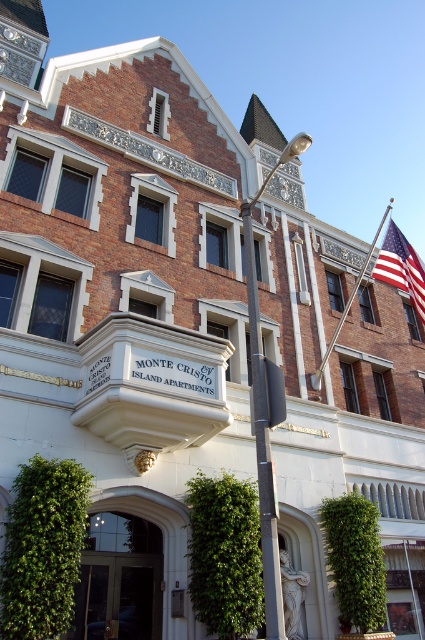
Does metallic pole at center have a lesser height compared to metallic flag pole at upper right?

Indeed, metallic pole at center has a lesser height compared to metallic flag pole at upper right.

Which of these two, metallic pole at center or metallic flag pole at upper right, stands shorter?

metallic pole at center is shorter.

Which is in front, point (246, 268) or point (371, 246)?

Point (246, 268)

Locate an element on the screen. The height and width of the screenshot is (640, 425). metallic pole at center is located at coordinates (265, 412).

The width and height of the screenshot is (425, 640). Describe the element at coordinates (265, 412) in the screenshot. I see `metallic pole at center` at that location.

Which is in front, point (272, 596) or point (382, 280)?

Point (272, 596) is more forward.

In order to click on metallic pole at center in this screenshot , I will do `click(265, 412)`.

Between point (422, 269) and point (325, 358), which one is positioned behind?

The point (422, 269) is more distant.

Where is `american flag at upper right`? The height and width of the screenshot is (640, 425). american flag at upper right is located at coordinates (401, 268).

Between point (377, 264) and point (340, 320), which one is positioned in front?

Point (340, 320) is more forward.

The width and height of the screenshot is (425, 640). Find the location of `american flag at upper right`. american flag at upper right is located at coordinates (401, 268).